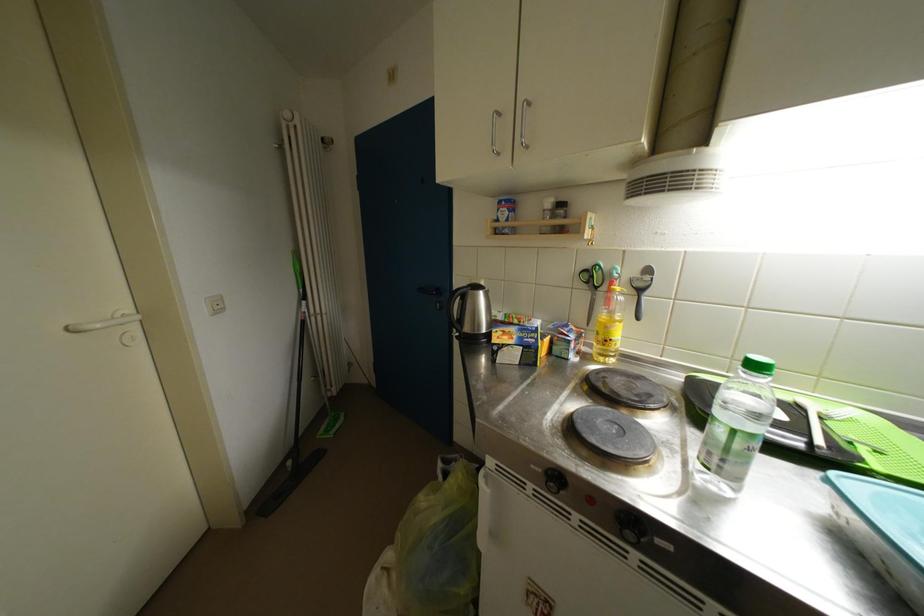
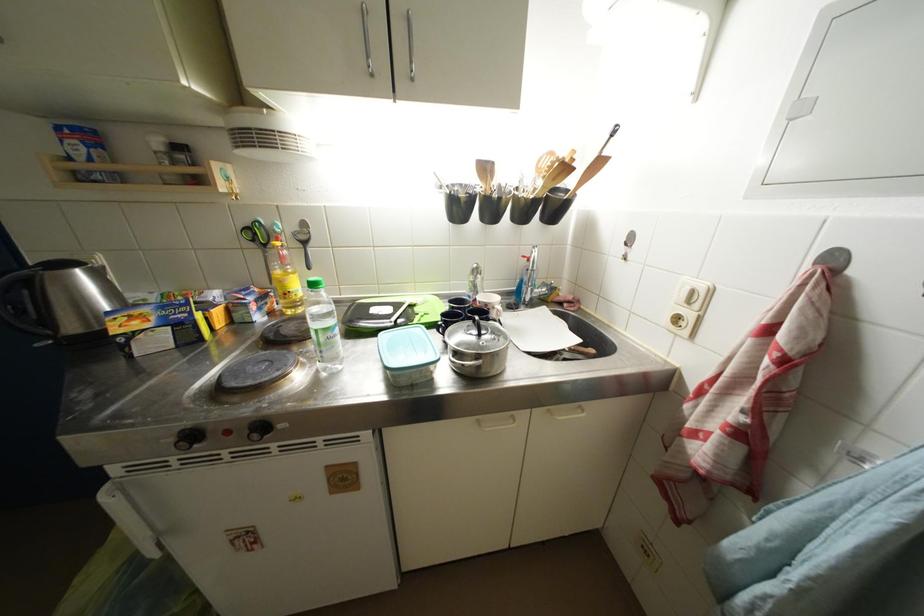
Find the pixel in the second image that matches [744,450] in the first image.

(329, 344)